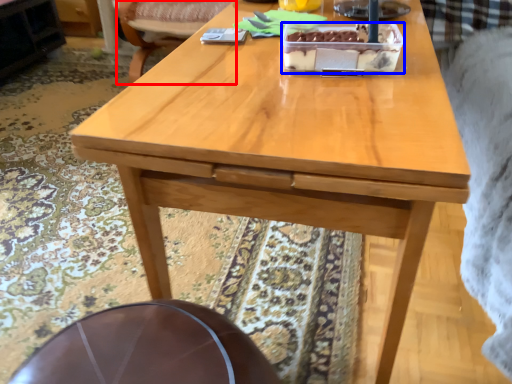
Question: Which object is further to the camera taking this photo, chair (highlighted by a red box) or cake (highlighted by a blue box)?

Choices:
 (A) chair
 (B) cake

Answer: (A)